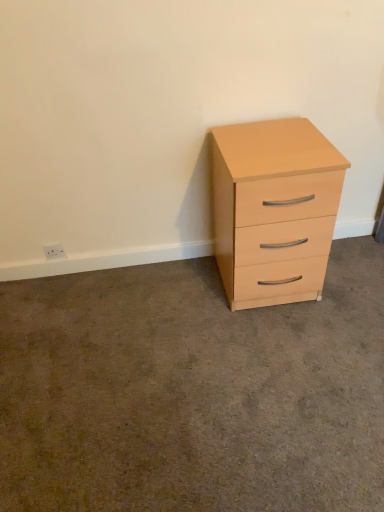
Question: Does matte wood cabinet at right appear on the right side of matte wood chest of drawers at right?

Choices:
 (A) no
 (B) yes

Answer: (A)

Question: Can matte wood chest of drawers at right be found inside matte wood cabinet at right?

Choices:
 (A) no
 (B) yes

Answer: (A)

Question: Is matte wood cabinet at right further to the viewer compared to matte wood chest of drawers at right?

Choices:
 (A) no
 (B) yes

Answer: (A)

Question: Can you confirm if matte wood cabinet at right is smaller than matte wood chest of drawers at right?

Choices:
 (A) yes
 (B) no

Answer: (A)

Question: Can you see matte wood cabinet at right touching matte wood chest of drawers at right?

Choices:
 (A) yes
 (B) no

Answer: (B)

Question: Is matte wood cabinet at right in front of matte wood chest of drawers at right?

Choices:
 (A) no
 (B) yes

Answer: (B)

Question: Is matte wood chest of drawers at right to the right of white plastic electric outlet at lower left from the viewer's perspective?

Choices:
 (A) yes
 (B) no

Answer: (A)

Question: Considering the relative sizes of matte wood chest of drawers at right and white plastic electric outlet at lower left in the image provided, is matte wood chest of drawers at right shorter than white plastic electric outlet at lower left?

Choices:
 (A) yes
 (B) no

Answer: (B)

Question: From the image's perspective, would you say matte wood chest of drawers at right is shown under white plastic electric outlet at lower left?

Choices:
 (A) no
 (B) yes

Answer: (A)

Question: Is matte wood chest of drawers at right in contact with white plastic electric outlet at lower left?

Choices:
 (A) yes
 (B) no

Answer: (B)

Question: Is matte wood chest of drawers at right far away from white plastic electric outlet at lower left?

Choices:
 (A) no
 (B) yes

Answer: (B)

Question: Does matte wood chest of drawers at right have a larger size compared to white plastic electric outlet at lower left?

Choices:
 (A) yes
 (B) no

Answer: (A)

Question: Is white plastic electric outlet at lower left turned away from matte wood chest of drawers at right?

Choices:
 (A) yes
 (B) no

Answer: (B)